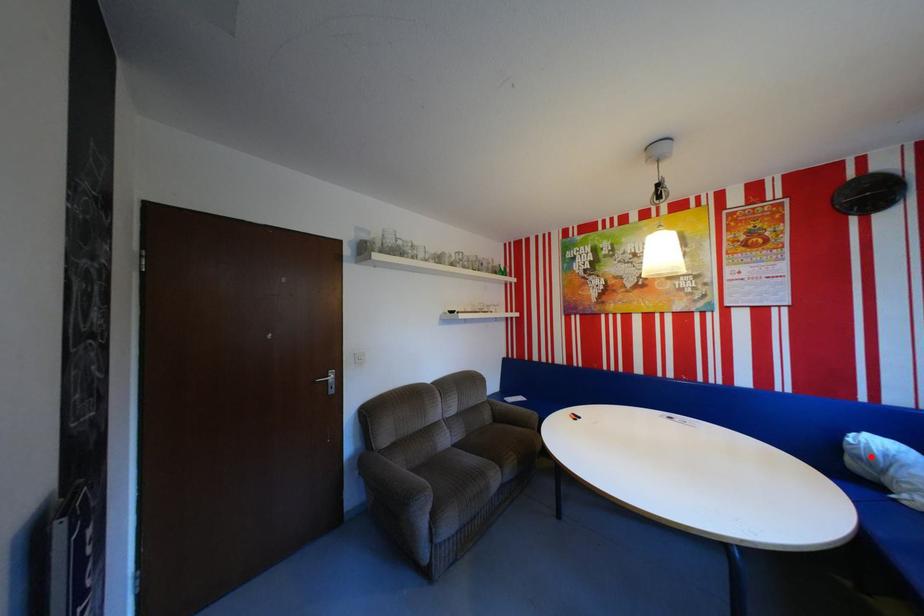
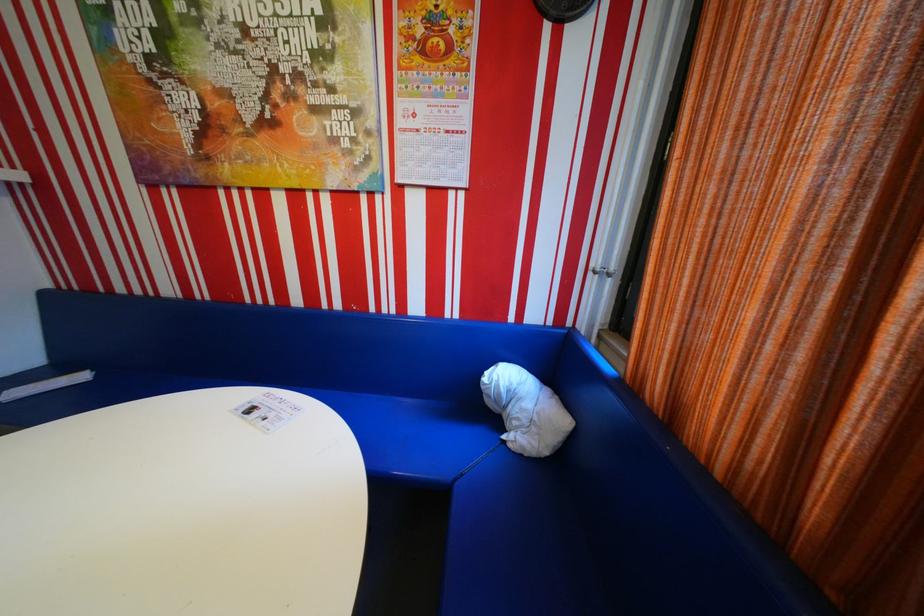
Question: I am providing you with two images of the same scene from different viewpoints. Given a red point in image1, look at the same physical point in image2. Is it:

Choices:
 (A) Closer to the viewpoint
 (B) Farther from the viewpoint

Answer: (B)